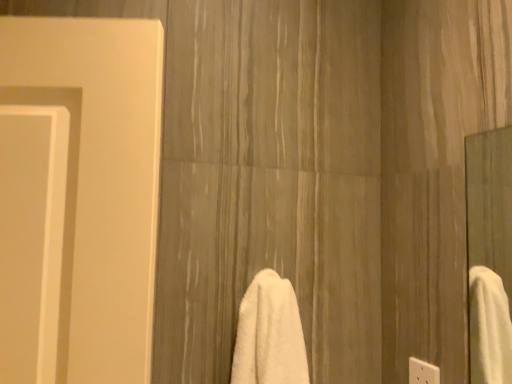
Question: From a real-world perspective, relative to white fluffy towel at center, is white plastic electric outlet at lower right vertically above or below?

Choices:
 (A) below
 (B) above

Answer: (A)

Question: Is white plastic electric outlet at lower right inside or outside of white fluffy towel at center?

Choices:
 (A) outside
 (B) inside

Answer: (A)

Question: From the image's perspective, relative to white fluffy towel at center, is white plastic electric outlet at lower right above or below?

Choices:
 (A) below
 (B) above

Answer: (A)

Question: From the image's perspective, is white fluffy towel at center located above or below white plastic electric outlet at lower right?

Choices:
 (A) below
 (B) above

Answer: (B)

Question: Would you say white fluffy towel at center is to the left or to the right of white plastic electric outlet at lower right in the picture?

Choices:
 (A) left
 (B) right

Answer: (A)

Question: From their relative heights in the image, would you say white fluffy towel at center is taller or shorter than white plastic electric outlet at lower right?

Choices:
 (A) tall
 (B) short

Answer: (A)

Question: In terms of size, does white fluffy towel at center appear bigger or smaller than white plastic electric outlet at lower right?

Choices:
 (A) big
 (B) small

Answer: (A)